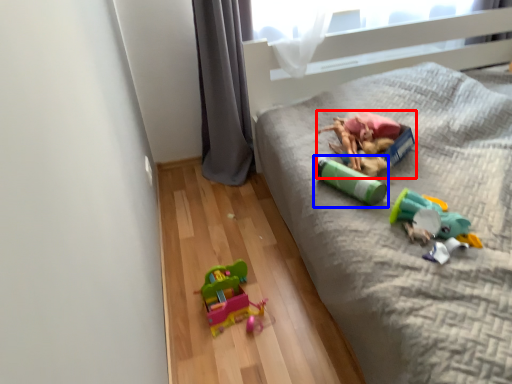
Question: Among these objects, which one is nearest to the camera, toy (highlighted by a red box) or toy (highlighted by a blue box)?

Choices:
 (A) toy
 (B) toy

Answer: (B)